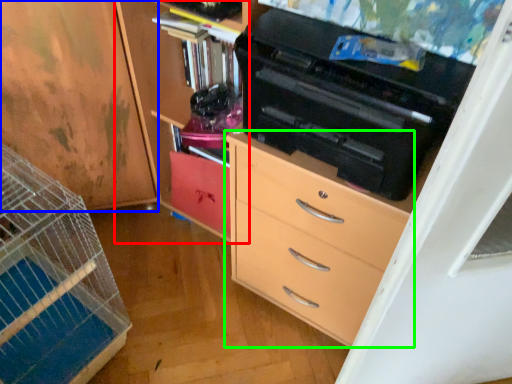
Question: Estimate the real-world distances between objects in this image. Which object is farther from cabinetry (highlighted by a red box), cabinetry (highlighted by a blue box) or chest of drawers (highlighted by a green box)?

Choices:
 (A) cabinetry
 (B) chest of drawers

Answer: (B)